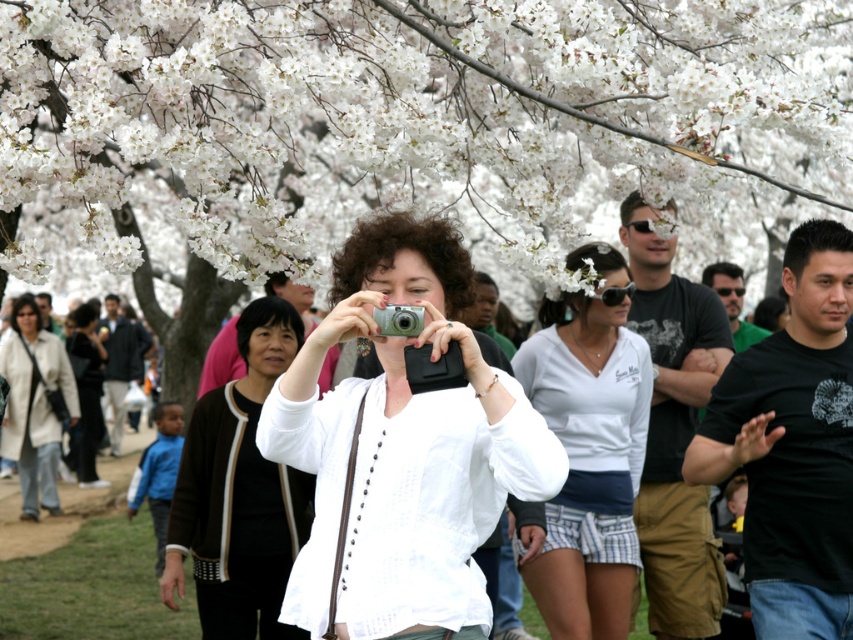
You are standing at the center of the scene and see the point marked at coordinates (239, 493). What object is located at that point?

The point at coordinates (239, 493) marks the white matte jacket at center.

You are a photographer trying to decide which jacket to wear for an outdoor shoot. You see the white matte jacket at center and the matte black jacket at center in the image. Based on their positions in the scene, which jacket is positioned higher?

The white matte jacket at center is positioned higher than the matte black jacket at center because it is described as being above it.